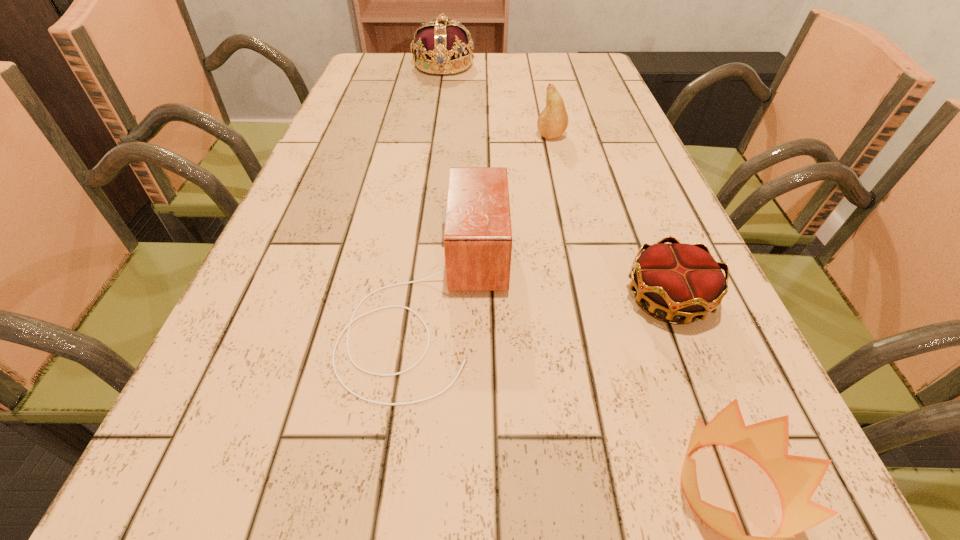
Where is `object identified as the fourth closest to the second farthest crown`? This screenshot has width=960, height=540. object identified as the fourth closest to the second farthest crown is located at coordinates (440, 46).

Locate an element on the screen. Image resolution: width=960 pixels, height=540 pixels. the second closest crown relative to the second farthest crown is located at coordinates (440, 46).

Find the location of `crown that can be found as the second closest to the leftmost crown`. crown that can be found as the second closest to the leftmost crown is located at coordinates (796, 478).

In order to click on vacant space that satisfies the following two spatial constraints: 1. on the front-facing side of the second farthest crown; 2. on the right side of the radio receiver in this screenshot , I will do `click(429, 298)`.

This screenshot has height=540, width=960. I want to click on free space that satisfies the following two spatial constraints: 1. on the front side of the second nearest crown; 2. on the left side of the farthest crown, so click(x=409, y=298).